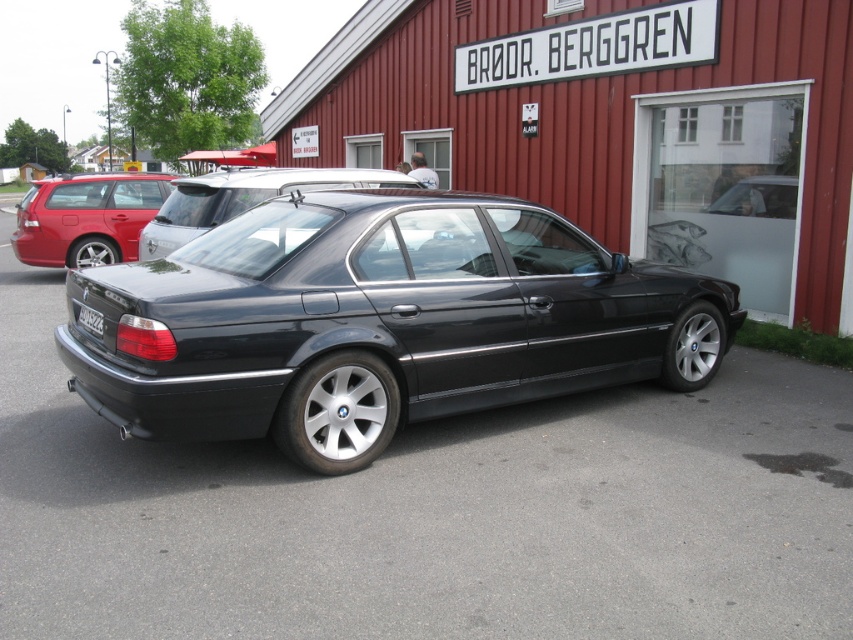
Is point (86, 177) more distant than point (254, 188)?

Yes, point (86, 177) is farther from viewer.

Which of these two, matte black station wagon at left or satin black car at center, stands taller?

matte black station wagon at left

Does point (126, 259) come in front of point (183, 189)?

No, it is behind (183, 189).

Locate an element on the screen. matte black station wagon at left is located at coordinates (86, 218).

Does glossy black car at center have a lesser width compared to matte black station wagon at left?

No.

Consider the image. Is glossy black car at center to the right of matte black station wagon at left from the viewer's perspective?

Yes, glossy black car at center is to the right of matte black station wagon at left.

Between point (219, 332) and point (100, 211), which one is positioned behind?

The point (100, 211) is more distant.

Identify the location of glossy black car at center. (378, 321).

Can you confirm if glossy black car at center is smaller than black plastic license plate at rear?

Incorrect, glossy black car at center is not smaller in size than black plastic license plate at rear.

Between point (228, 348) and point (97, 321), which one is positioned behind?

The point (97, 321) is more distant.

Between point (579, 310) and point (80, 314), which one is positioned in front?

Point (80, 314) is more forward.

Find the location of a particular element. glossy black car at center is located at coordinates (378, 321).